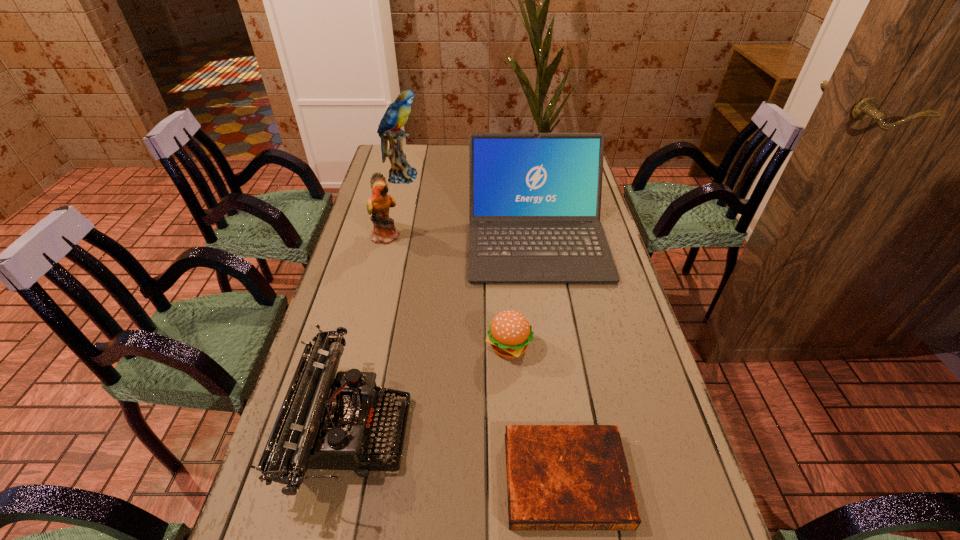
The height and width of the screenshot is (540, 960). What are the coordinates of `blank area in the image that satisfies the following two spatial constraints: 1. on the front-facing side of the nearer parrot; 2. on the left side of the hamburger` in the screenshot? It's located at (359, 347).

Identify the location of free space that satisfies the following two spatial constraints: 1. on the face of the farthest object; 2. on the back side of the fifth tallest object. (359, 347).